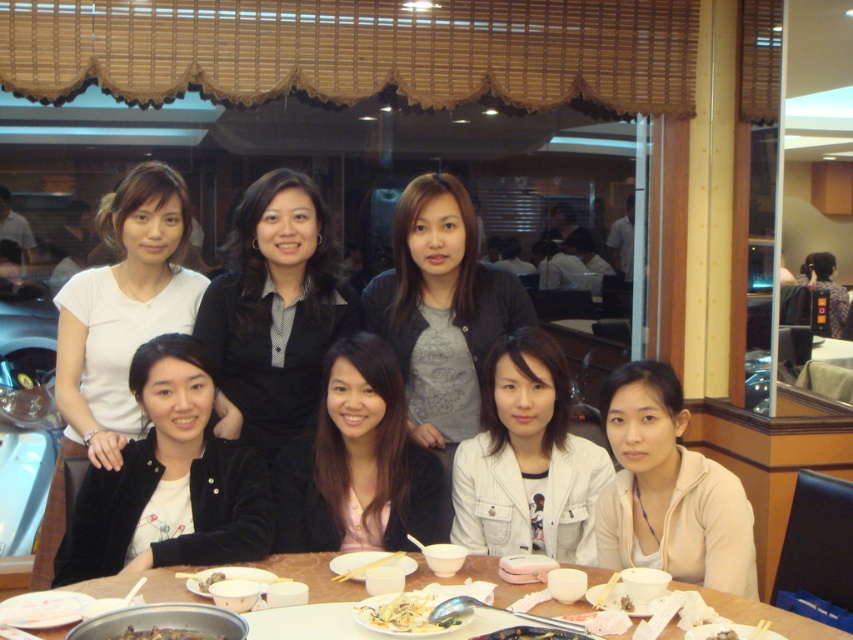
Question: Can you confirm if white matte shirt at upper left is wider than brown glossy meat at center?

Choices:
 (A) no
 (B) yes

Answer: (B)

Question: Which object appears closest to the camera in this image?

Choices:
 (A) black satin blouse at center
 (B) pink satin blouse at center
 (C) white matte jacket at lower right
 (D) white matte jacket at center

Answer: (C)

Question: Among these objects, which one is nearest to the camera?

Choices:
 (A) white glossy noodles at center
 (B) white matte jacket at center
 (C) pink satin blouse at center

Answer: (A)

Question: Is white matte jacket at lower right above wooden table at center?

Choices:
 (A) yes
 (B) no

Answer: (A)

Question: Is gray matte shirt at center further to the viewer compared to pink satin blouse at center?

Choices:
 (A) no
 (B) yes

Answer: (B)

Question: Among these points, which one is nearest to the camera?

Choices:
 (A) (96, 300)
 (B) (310, 300)
 (C) (642, 552)
 (D) (466, 349)

Answer: (C)